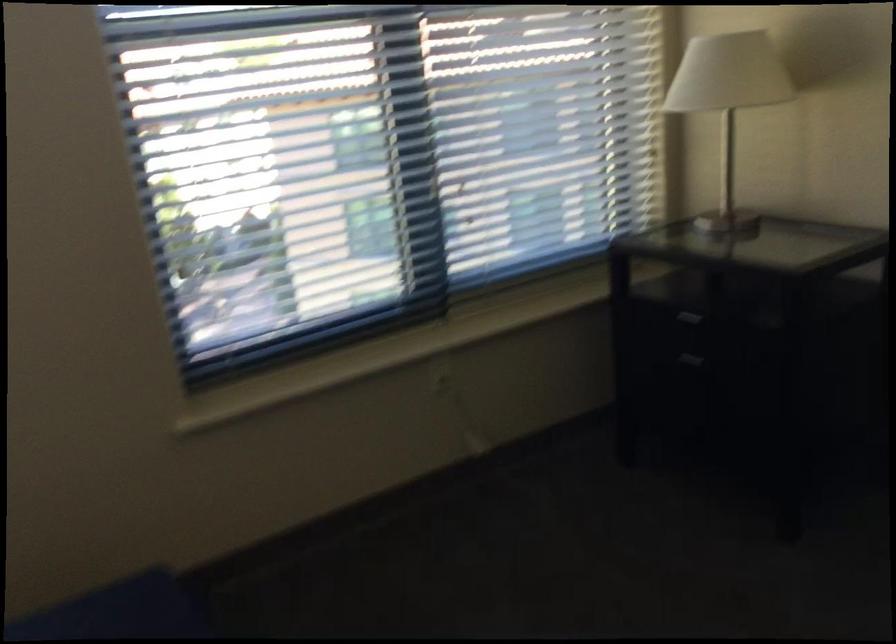
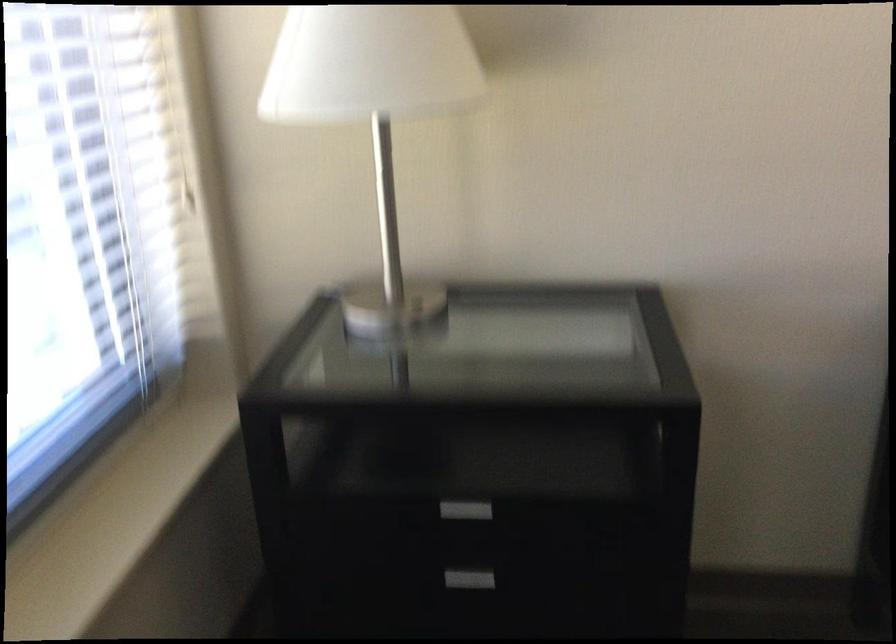
Where in the second image is the point corresponding to point 682,375 from the first image?

(476, 569)